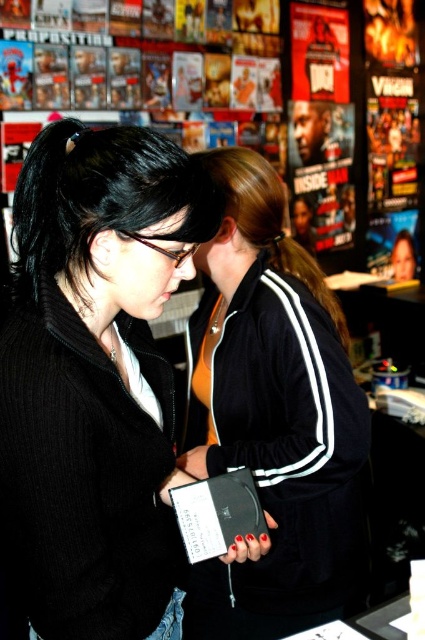
Question: Does black matte jacket at center have a larger size compared to black velour jacket at center?

Choices:
 (A) no
 (B) yes

Answer: (A)

Question: Can you confirm if black matte jacket at center is thinner than black velour jacket at center?

Choices:
 (A) yes
 (B) no

Answer: (B)

Question: Can you confirm if black matte jacket at center is positioned to the left of black velour jacket at center?

Choices:
 (A) no
 (B) yes

Answer: (B)

Question: Which of the following is the closest to the observer?

Choices:
 (A) black velour jacket at center
 (B) black matte jacket at center

Answer: (B)